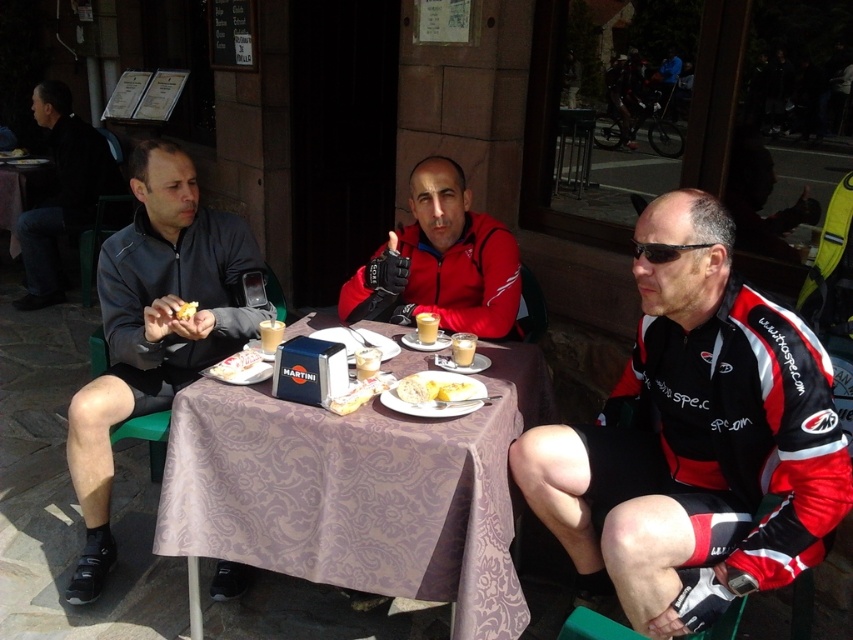
You are standing at point (114,276) and want to walk to point (788,547). Based on the scene description, is the path between these two points clear of obstacles?

Point (788,547) is in front of point (114,276). Since the scene shows three people seated around a small table with items on it, there might be obstacles like the table or chairs blocking the path between the two points. However, the description states that point (788,547) is in front of point (114,276), which suggests that the path is clear, so yes, the path is clear.

Consider the image. You are a customer at the outdoor table and want to reach for the white bread at table center without touching the red and black cycling jersey at center. Is this possible?

The red and black cycling jersey at center is in front of the white bread at table center, so you cannot reach the white bread at table center without moving the jersey first.